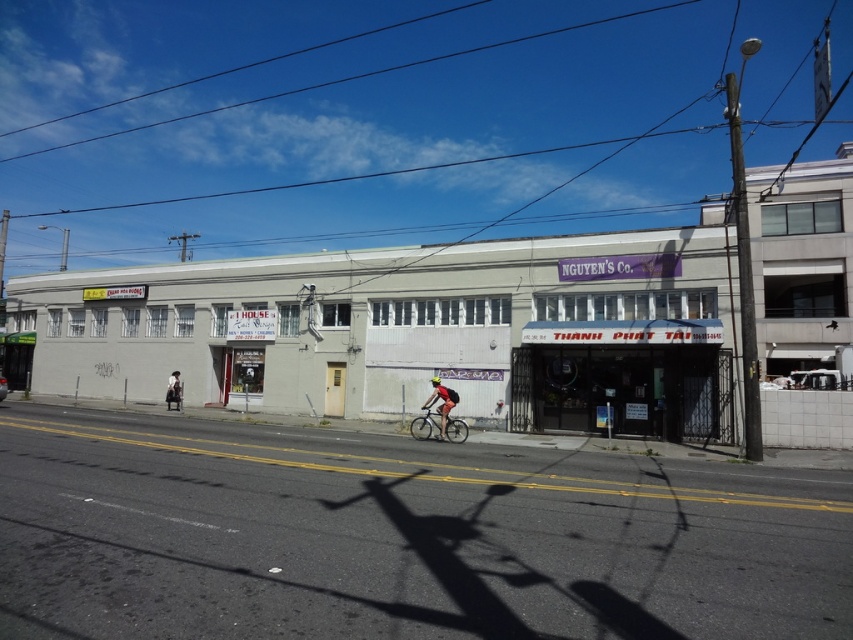
You are a delivery person who needs to park your shiny red bicycle at center near the metallic silver storefront at center. Can you park your bicycle there if the parking space is 6 meters long?

The metallic silver storefront at center and shiny red bicycle at center are 5.64 meters apart, so yes, the parking space is 6 meters long which is longer than the distance between them. Therefore, the bicycle can be parked there.